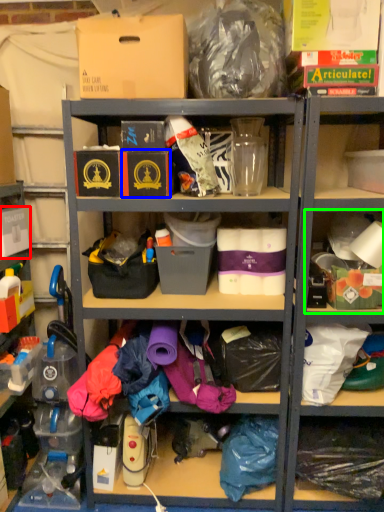
Question: Considering the real-world distances, which object is closest to storage box (highlighted by a red box)? storage box (highlighted by a blue box) or shelf (highlighted by a green box).

Choices:
 (A) storage box
 (B) shelf

Answer: (A)